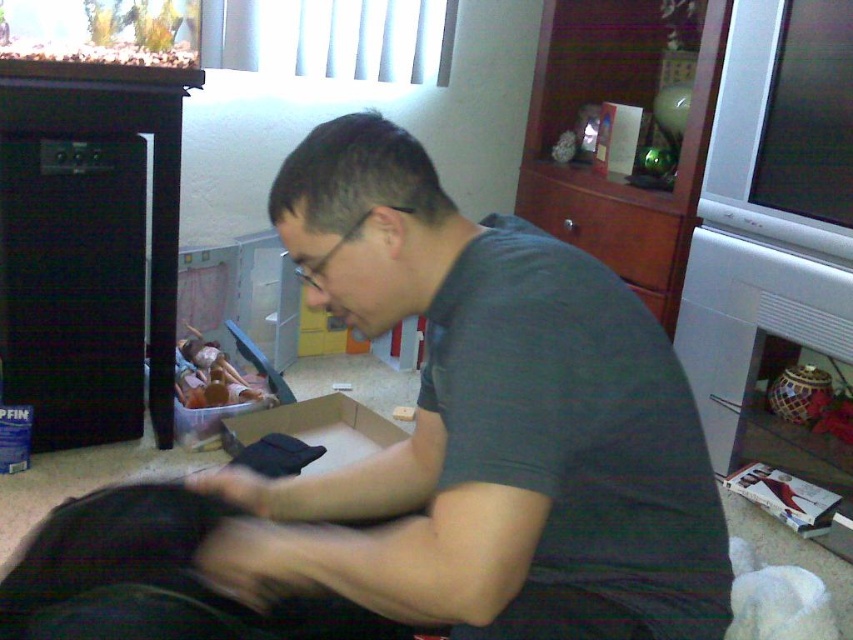
Is dark gray t-shirt at center smaller than black fabric bag at lower left?

Actually, dark gray t-shirt at center might be larger than black fabric bag at lower left.

Who is positioned more to the right, dark gray t-shirt at center or black fabric bag at lower left?

dark gray t-shirt at center is more to the right.

Who is more distant from viewer, (321,188) or (91,588)?

The point (91,588) is more distant.

Image resolution: width=853 pixels, height=640 pixels. Find the location of `dark gray t-shirt at center`. dark gray t-shirt at center is located at coordinates (485, 426).